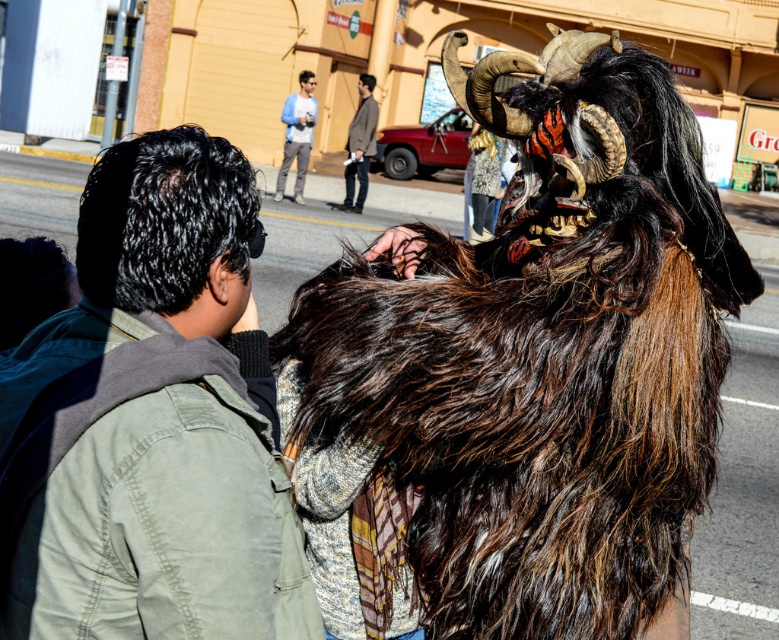
You are a photographer trying to capture a closeup of the furry brown mask at center and the green fabric jacket at center in the image. Given their sizes, which one will appear bigger in your photo?

The furry brown mask at center is larger in size than the green fabric jacket at center, so it will appear bigger in the photo.

You are a photographer trying to capture the mythical creature costume in the center of the image. The costume has a large furry brown mask with horns. You want to focus your camera on the exact center of the mask. Given that the image coordinate system has its origin at the bottom left corner, with x increasing to the right and y increasing upwards, can you determine if the point at coordinates point (523, 372) is located on the mask?

The point (523, 372) corresponds to the furry brown mask at center, so yes, the point is located on the mask.